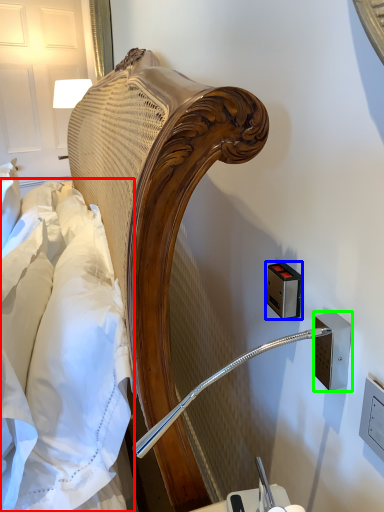
Question: Estimate the real-world distances between objects in this image. Which object is farther from sheet (highlighted by a red box), electric outlet (highlighted by a blue box) or electric outlet (highlighted by a green box)?

Choices:
 (A) electric outlet
 (B) electric outlet

Answer: (B)